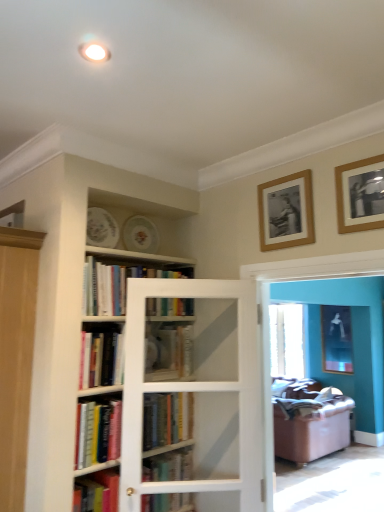
Find the location of a particular element. The width and height of the screenshot is (384, 512). vacant point above hardcover books at upper center, which is counted as the sixth book, starting from the bottom (from a real-world perspective) is located at coordinates (135, 260).